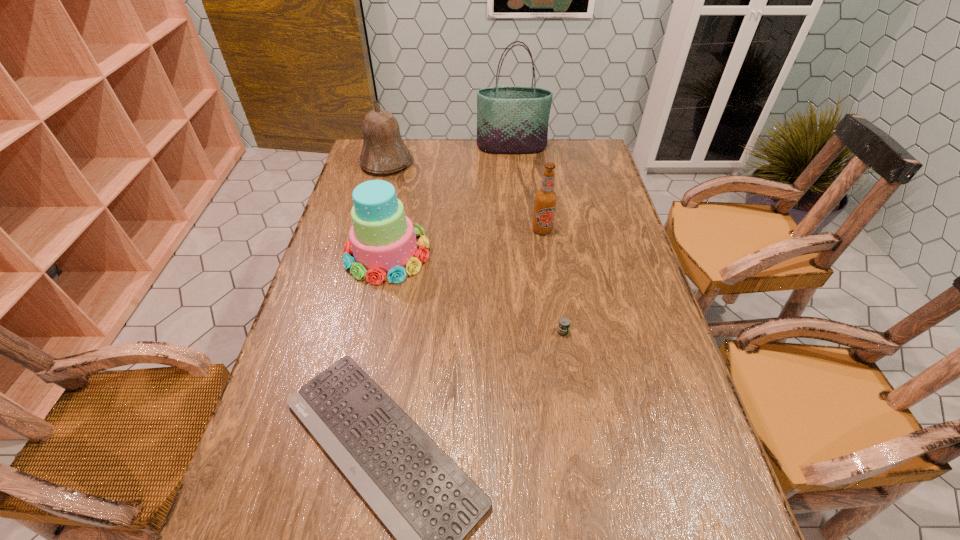
Image resolution: width=960 pixels, height=540 pixels. Find the location of `vacant space positioned 0.270m on the left of the fifth farthest object`. vacant space positioned 0.270m on the left of the fifth farthest object is located at coordinates (441, 332).

Locate an element on the screen. tote bag present at the far edge is located at coordinates (510, 119).

The image size is (960, 540). Find the location of `bell at the far edge`. bell at the far edge is located at coordinates (384, 151).

Image resolution: width=960 pixels, height=540 pixels. Identify the location of bell present at the left edge. (384, 151).

Where is `cake that is positioned at the left edge`? cake that is positioned at the left edge is located at coordinates (382, 240).

Find the location of a particular element. The width and height of the screenshot is (960, 540). object that is at the far left corner is located at coordinates (384, 151).

Where is `vacant region at the far edge`? This screenshot has height=540, width=960. vacant region at the far edge is located at coordinates (470, 143).

Find the location of a particular element. This screenshot has height=540, width=960. free space at the left edge of the desktop is located at coordinates (287, 457).

I want to click on free space at the right edge of the desktop, so click(x=651, y=362).

This screenshot has width=960, height=540. Identify the location of free space at the far right corner of the desktop. pyautogui.click(x=584, y=161).